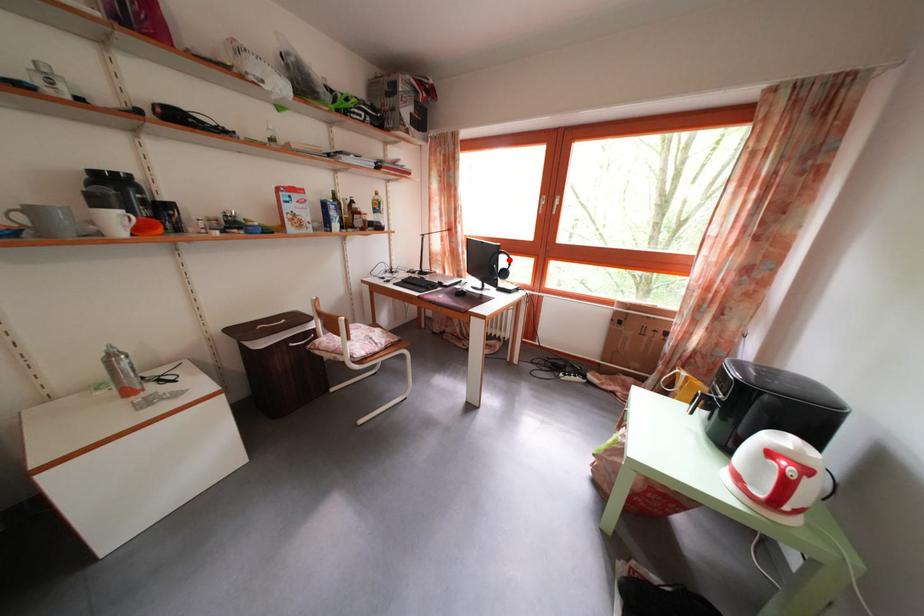
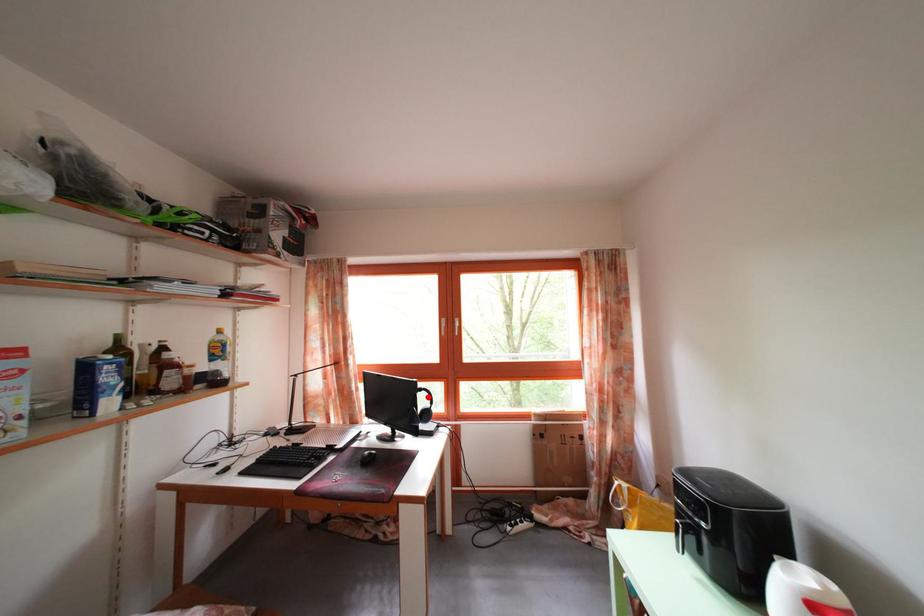
I am providing you with two images of the same scene from different viewpoints. A red point is marked on the first image and another point is marked on the second image. Do the highlighted points in image1 and image2 indicate the same real-world spot?

Yes